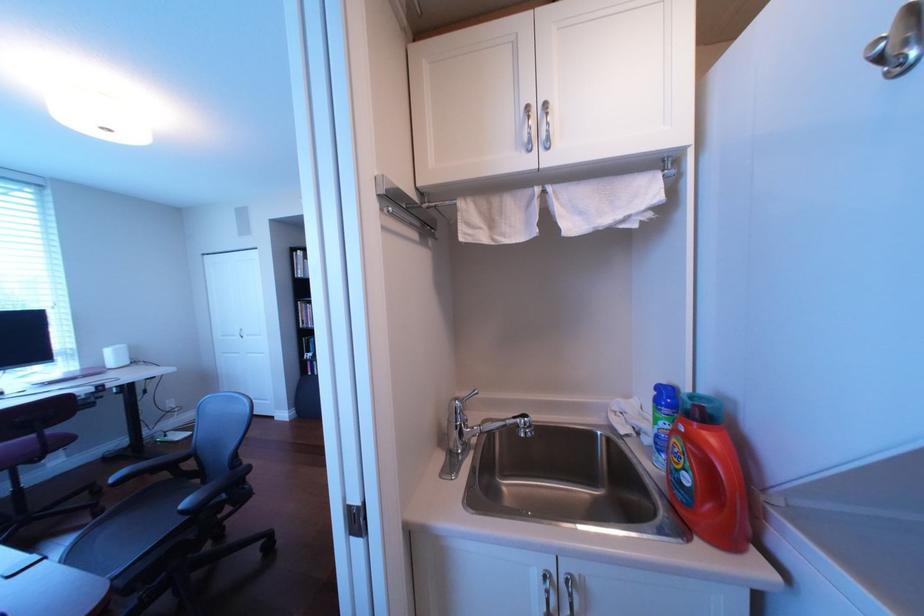
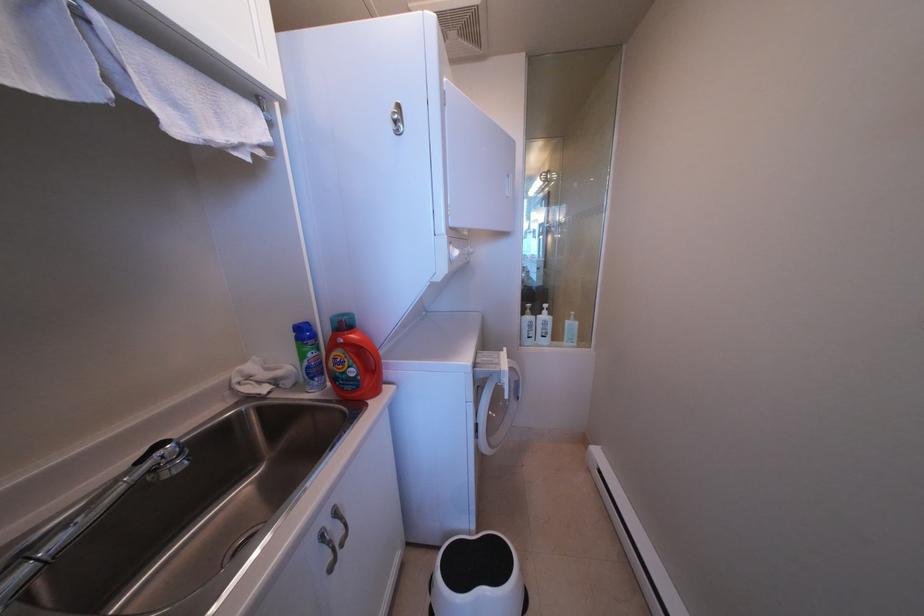
Question: The camera is either moving clockwise (left) or counter-clockwise (right) around the object. The first image is from the beginning of the video and the second image is from the end. Is the camera moving left or right when shooting the video?

Choices:
 (A) Left
 (B) Right

Answer: (A)